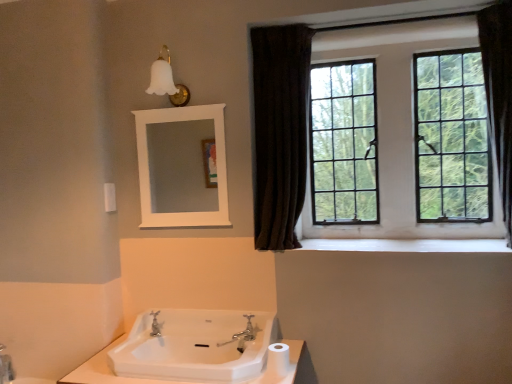
Identify the location of vacant area on top of dark brown velvet curtain at upper right (from a real-world perspective). The height and width of the screenshot is (384, 512). pos(287,19).